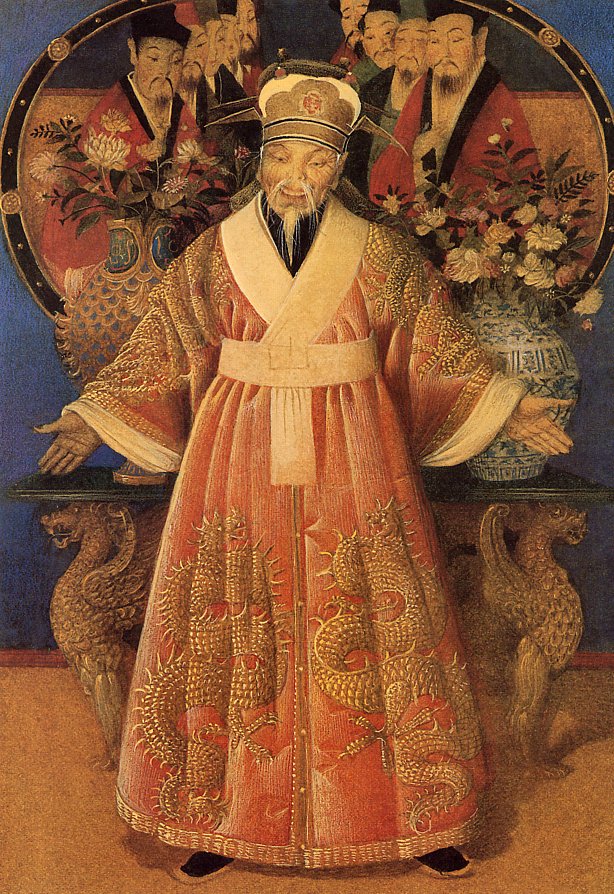
Where is `painting`? The width and height of the screenshot is (614, 894). painting is located at coordinates [x=293, y=257].